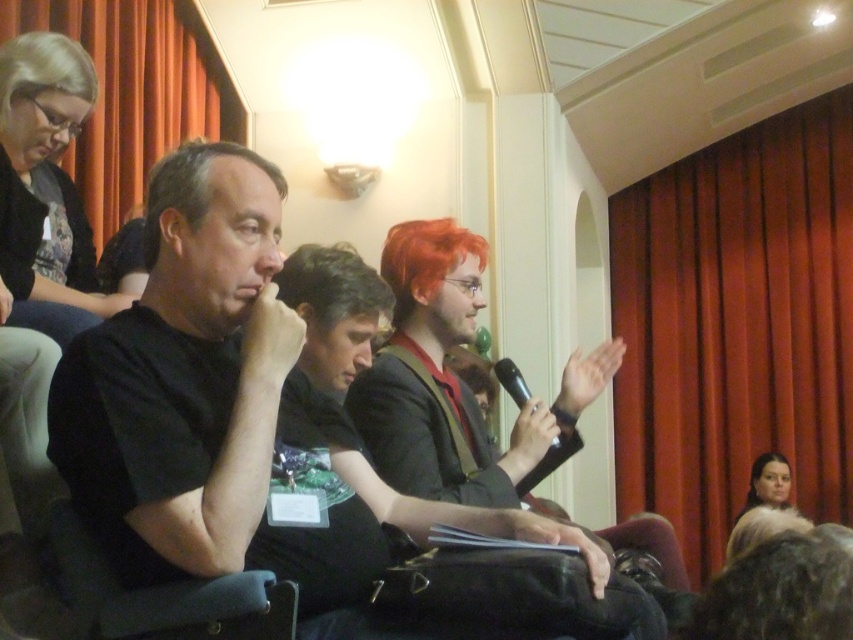
Can you confirm if red velvet curtain at right is bigger than brown matte wig at center?

Yes.

Between point (639, 352) and point (178, 195), which one is positioned in front?

Positioned in front is point (178, 195).

The height and width of the screenshot is (640, 853). Find the location of `red velvet curtain at right`. red velvet curtain at right is located at coordinates (735, 324).

Does shiny orange wig at center have a greater width compared to brown matte wig at center?

Yes, shiny orange wig at center is wider than brown matte wig at center.

Can you confirm if shiny orange wig at center is positioned to the left of brown matte wig at center?

No, shiny orange wig at center is not to the left of brown matte wig at center.

Does point (428, 298) come in front of point (177, 154)?

No, it is not.

The height and width of the screenshot is (640, 853). Find the location of `shiny orange wig at center`. shiny orange wig at center is located at coordinates [425, 259].

Can you confirm if blonde synthetic wig at upper left is positioned to the right of fur coat at lower right?

In fact, blonde synthetic wig at upper left is to the left of fur coat at lower right.

At what (x,y) coordinates should I click in order to perform the action: click on blonde synthetic wig at upper left. Please return your answer as a coordinate pair (x, y). The image size is (853, 640). Looking at the image, I should click on pyautogui.click(x=44, y=68).

Does point (91, 96) lie in front of point (781, 461)?

That is True.

The height and width of the screenshot is (640, 853). In order to click on blonde synthetic wig at upper left in this screenshot , I will do [x=44, y=68].